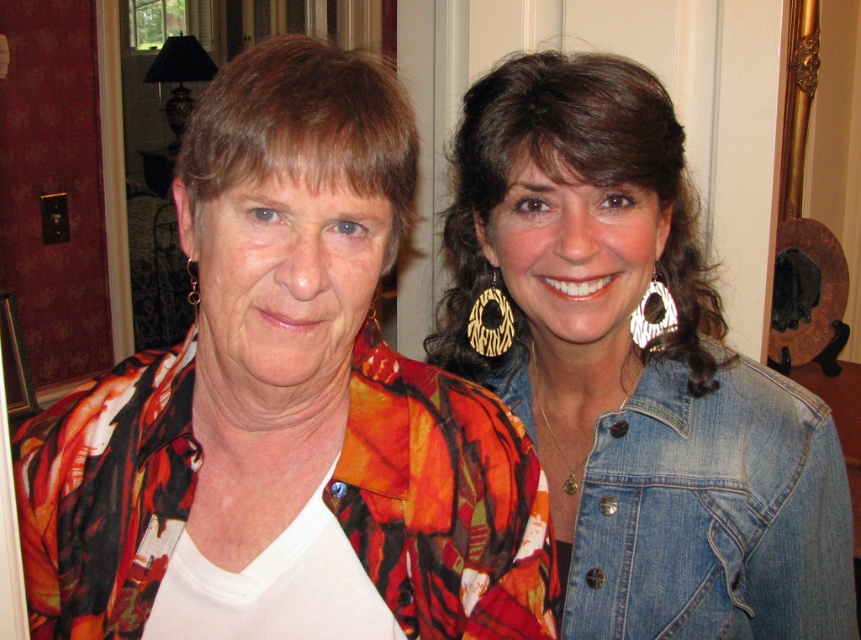
Question: Can you confirm if faded denim jacket at lower right is bigger than gold textured earring at left?

Choices:
 (A) no
 (B) yes

Answer: (A)

Question: Does faded denim jacket at lower right have a smaller size compared to gold textured earring at left?

Choices:
 (A) yes
 (B) no

Answer: (A)

Question: Which of the following is the farthest from the observer?

Choices:
 (A) (271, 204)
 (B) (587, 564)
 (C) (191, 292)
 (D) (637, 460)

Answer: (C)

Question: Which is farther from the gold textured earring at left?

Choices:
 (A) faded denim jacket at lower right
 (B) denim jacket at upper right
 (C) printed fabric shirt at center

Answer: (C)

Question: Which point is closer to the camera taking this photo?

Choices:
 (A) (744, 579)
 (B) (189, 256)

Answer: (B)

Question: Is denim jacket at upper right thinner than faded denim jacket at lower right?

Choices:
 (A) no
 (B) yes

Answer: (A)